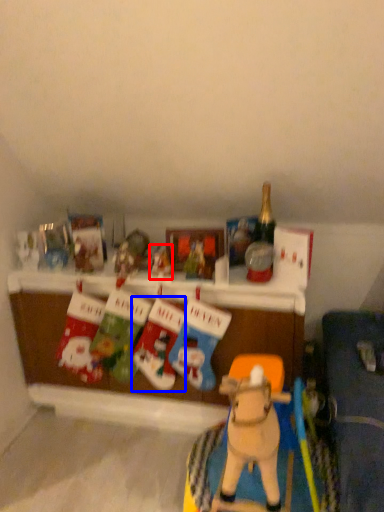
Question: Which point is further to the camera, toy (highlighted by a red box) or toy (highlighted by a blue box)?

Choices:
 (A) toy
 (B) toy

Answer: (A)